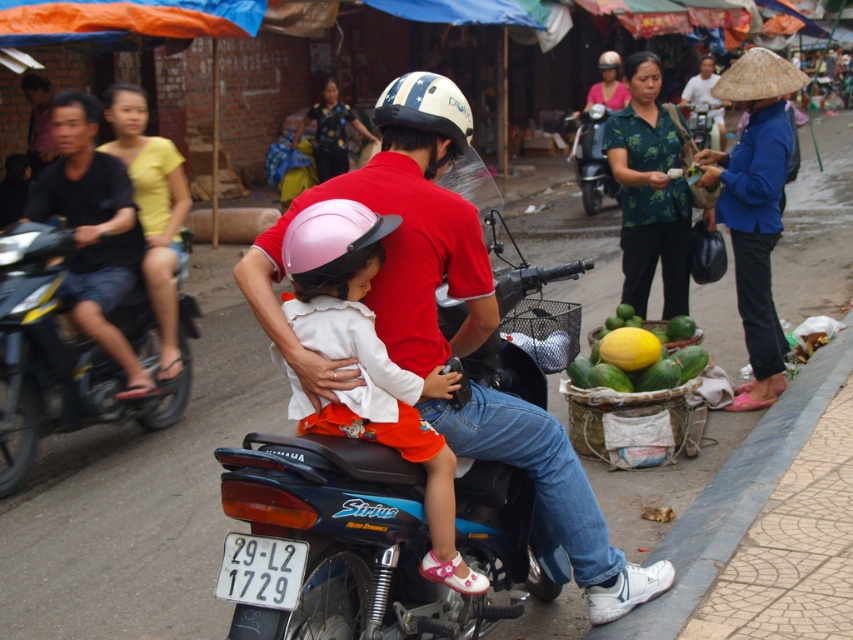
You are a passerby observing the scene. There are two shirts visible on the motorbike rider. The matte red shirt at center and the green floral shirt at center. Which shirt is positioned more to the left?

The matte red shirt at center is positioned more to the left than the green floral shirt at center.

You are a photographer standing at the center of the street. You want to take a photo of the matte red shirt at center. Where should you aim your camera to capture it?

You should aim your camera at the point with coordinates (x=390, y=264) to capture the matte red shirt at center.

You are a delivery person who needs to deliver a package to a location marked by point [428,244] and then to another location marked by point [370,426]. Based on the scene, which point should you visit first to follow the correct delivery route?

You should visit point [370,426] first because point [428,244] is behind it, meaning the delivery route starts at the front point before moving to the one behind.